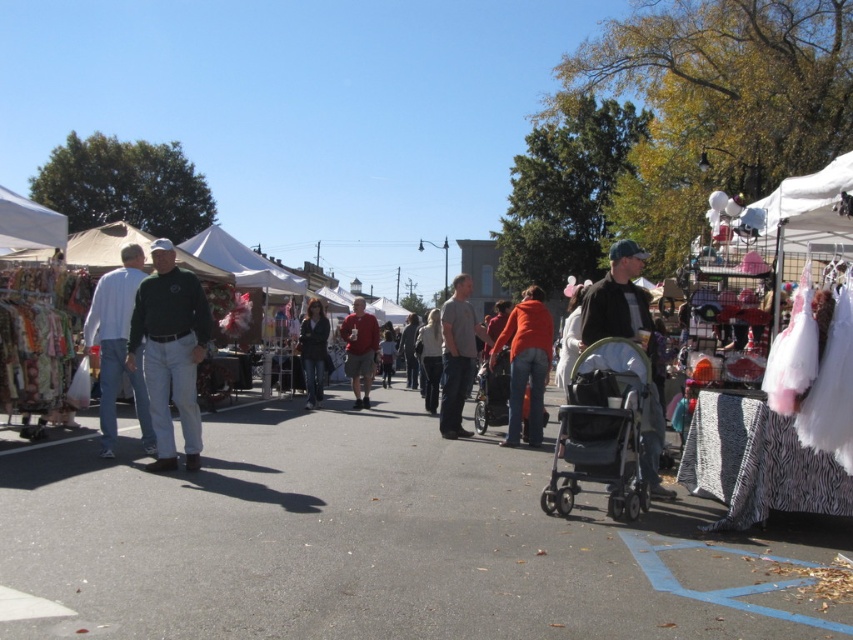
Can you confirm if dark gray fabric stroller at center is smaller than green jersey at center?

Indeed, dark gray fabric stroller at center has a smaller size compared to green jersey at center.

Between dark gray fabric stroller at center and green jersey at center, which one appears on the left side from the viewer's perspective?

Positioned to the left is green jersey at center.

Who is more forward, (593, 433) or (181, 362)?

Point (593, 433) is in front.

At what (x,y) coordinates should I click in order to perform the action: click on dark gray fabric stroller at center. Please return your answer as a coordinate pair (x, y). Looking at the image, I should click on (x=602, y=429).

Between orange cotton jacket at center and matte red shirt at center, which one has more height?

matte red shirt at center

Can you confirm if orange cotton jacket at center is thinner than matte red shirt at center?

Yes, orange cotton jacket at center is thinner than matte red shirt at center.

Which is in front, point (543, 324) or point (352, 342)?

Point (543, 324)

Identify the location of orange cotton jacket at center. (526, 364).

Which is above, dark gray fabric stroller at center or dark gray jacket at center?

Positioned higher is dark gray jacket at center.

Looking at this image, does dark gray fabric stroller at center have a larger size compared to dark gray jacket at center?

No, dark gray fabric stroller at center is not bigger than dark gray jacket at center.

Is point (631, 440) less distant than point (637, 308)?

Yes, point (631, 440) is closer to viewer.

Locate an element on the screen. dark gray fabric stroller at center is located at coordinates (602, 429).